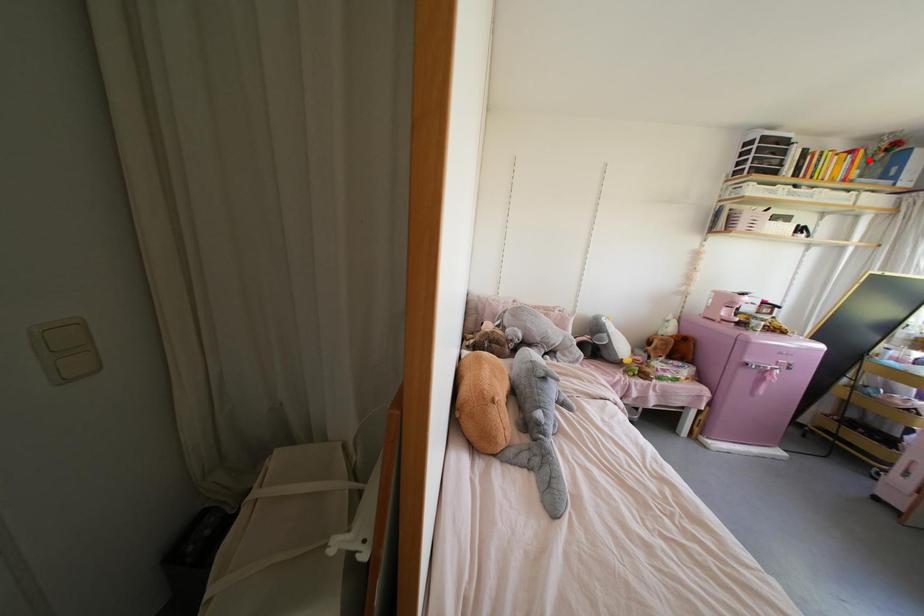
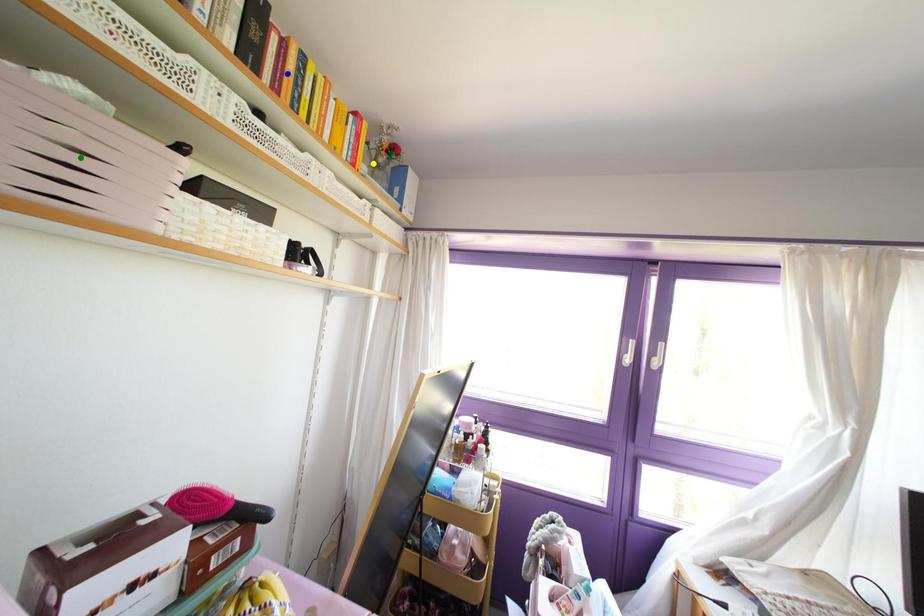
Question: I am providing you with two images of the same scene from different viewpoints. A red point is marked on the first image. You are given multiple points on the second image. In image 2, which mark is for the same physical point as the one in image 1?

Choices:
 (A) blue point
 (B) green point
 (C) yellow point

Answer: (C)